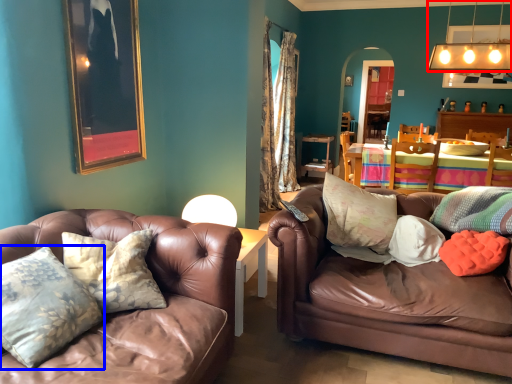
Question: Which object appears farthest to the camera in this image, lamp (highlighted by a red box) or pillow (highlighted by a blue box)?

Choices:
 (A) lamp
 (B) pillow

Answer: (A)